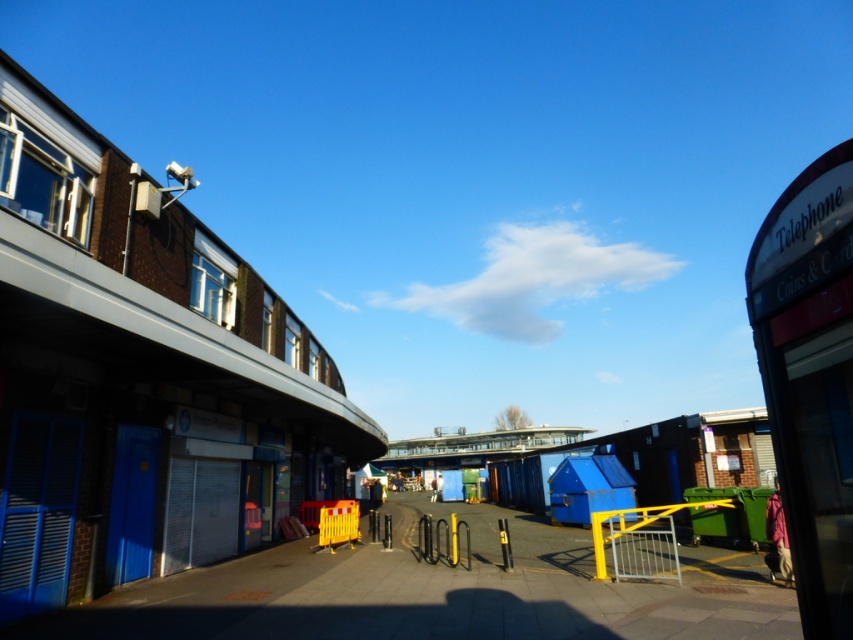
Which of these two, blue corrugated metal beach hut at left or white plastic telephone booth at right, stands taller?

Standing taller between the two is blue corrugated metal beach hut at left.

Is the position of blue corrugated metal beach hut at left more distant than that of white plastic telephone booth at right?

Yes.

Is point (9, 198) positioned in front of point (793, 250)?

No, it is not.

The height and width of the screenshot is (640, 853). In order to click on blue corrugated metal beach hut at left in this screenshot , I will do `click(140, 372)`.

Does point (769, 316) come behind point (567, 435)?

No.

Which is in front, point (834, 262) or point (451, 449)?

Positioned in front is point (834, 262).

Which is behind, point (833, 244) or point (509, 436)?

The point (509, 436) is more distant.

This screenshot has width=853, height=640. I want to click on white plastic telephone booth at right, so click(x=810, y=376).

Between point (375, 451) and point (521, 435), which one is positioned behind?

The point (521, 435) is more distant.

Is blue corrugated metal beach hut at left to the left of blue metallic bridge at center from the viewer's perspective?

Yes, blue corrugated metal beach hut at left is to the left of blue metallic bridge at center.

In order to click on blue corrugated metal beach hut at left in this screenshot , I will do `click(140, 372)`.